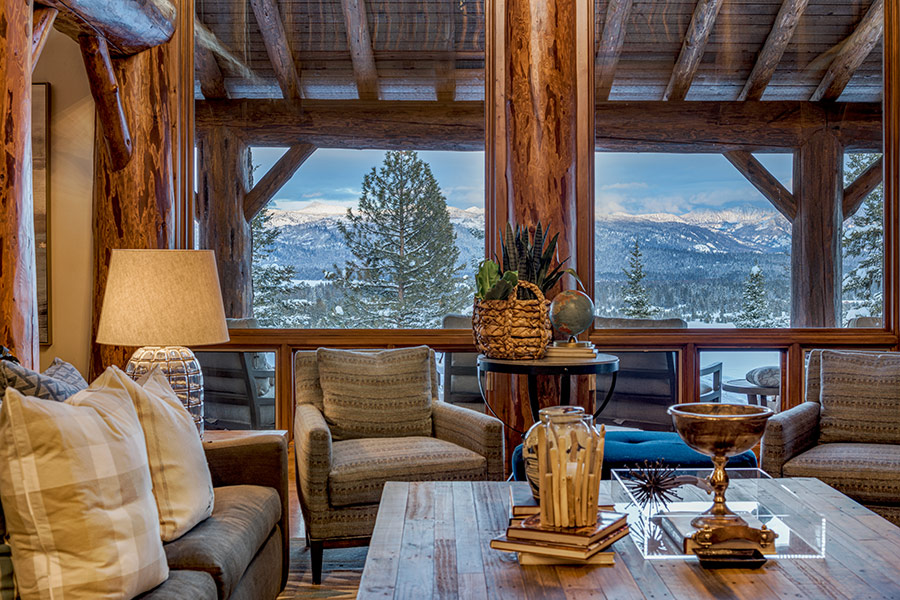
What are the coordinates of `dark brown hardwood table` in the screenshot? It's located at (621, 580), (855, 577).